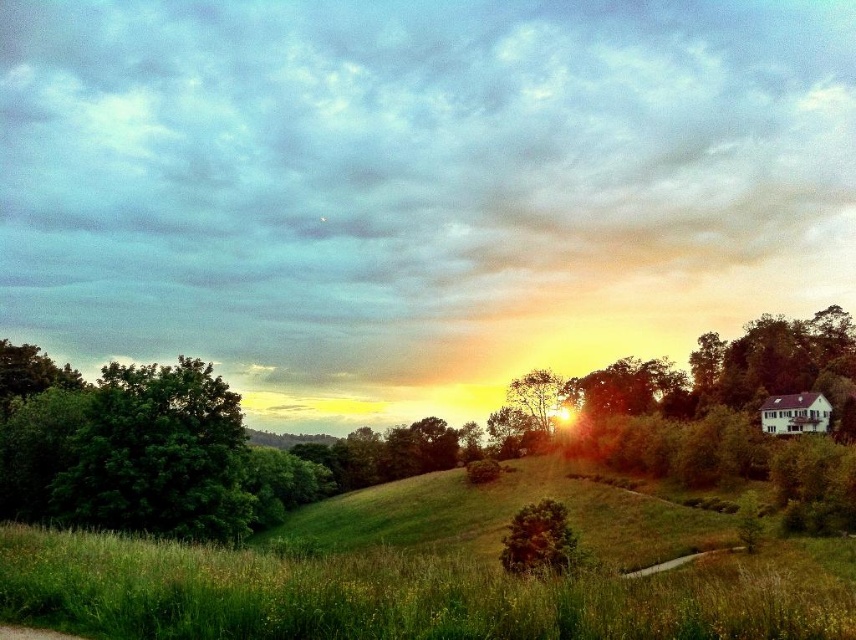
Question: Which of the following is the farthest from the observer?

Choices:
 (A) green leafy tree at center
 (B) green leafy tree at left
 (C) green grassy hill at center

Answer: (A)

Question: Which point is farther from the camera taking this photo?

Choices:
 (A) (82, 616)
 (B) (220, 419)

Answer: (B)

Question: Is green grassy hill at center above green leafy tree at center?

Choices:
 (A) yes
 (B) no

Answer: (B)

Question: Is green grassy hill at center positioned behind green leafy tree at center?

Choices:
 (A) yes
 (B) no

Answer: (B)

Question: Does green grassy hill at center appear over green leafy tree at left?

Choices:
 (A) no
 (B) yes

Answer: (A)

Question: Which object is closer to the camera taking this photo?

Choices:
 (A) green grassy hill at center
 (B) green leafy tree at left

Answer: (A)